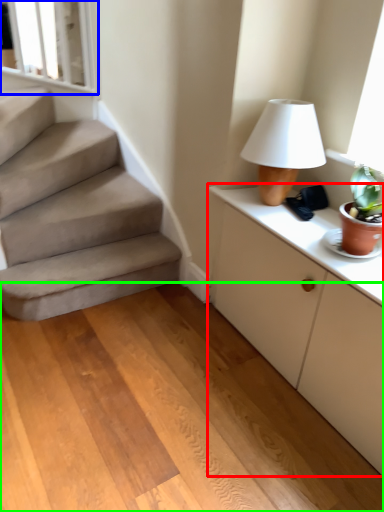
Question: Which object is positioned farthest from cabinetry (highlighted by a red box)? Select from window frame (highlighted by a blue box) and concrete (highlighted by a green box).

Choices:
 (A) window frame
 (B) concrete

Answer: (A)